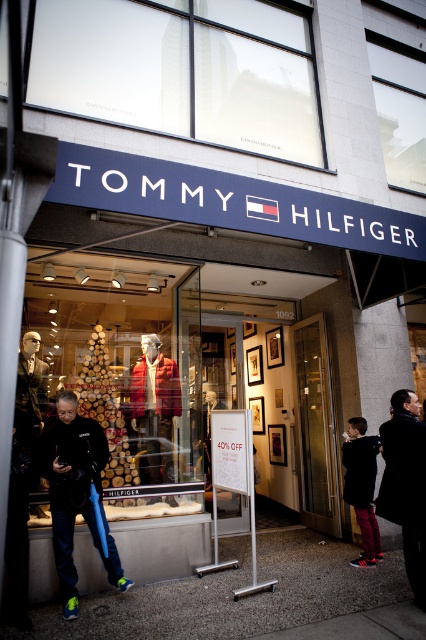
Question: Which of the following is the closest to the observer?

Choices:
 (A) (310, 513)
 (B) (117, 580)
 (C) (417, 483)
 (D) (138, 72)

Answer: (C)

Question: Does transparent glass at upper center have a greater width compared to glass door at center?

Choices:
 (A) yes
 (B) no

Answer: (A)

Question: Which point appears closest to the camera in this image?

Choices:
 (A) (60, 579)
 (B) (406, 493)

Answer: (B)

Question: Does transparent glass at upper center appear on the right side of black matte jacket at lower left?

Choices:
 (A) yes
 (B) no

Answer: (A)

Question: Which is nearer to the dark gray coat at lower right?

Choices:
 (A) transparent glass at upper center
 (B) black matte jacket at lower left
 (C) glass door at center

Answer: (C)

Question: Considering the relative positions of transparent glass at upper center and glass door at center in the image provided, where is transparent glass at upper center located with respect to glass door at center?

Choices:
 (A) below
 (B) above

Answer: (B)